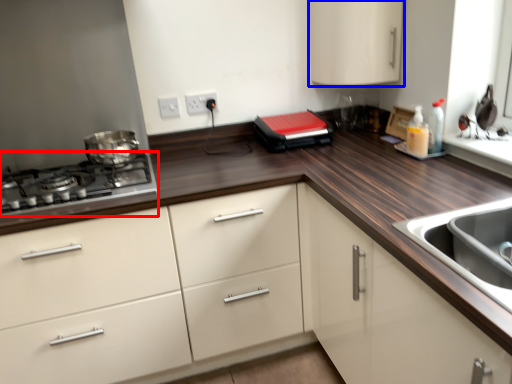
Question: Which object appears closest to the camera in this image, gas stove (highlighted by a red box) or cabinetry (highlighted by a blue box)?

Choices:
 (A) gas stove
 (B) cabinetry

Answer: (A)